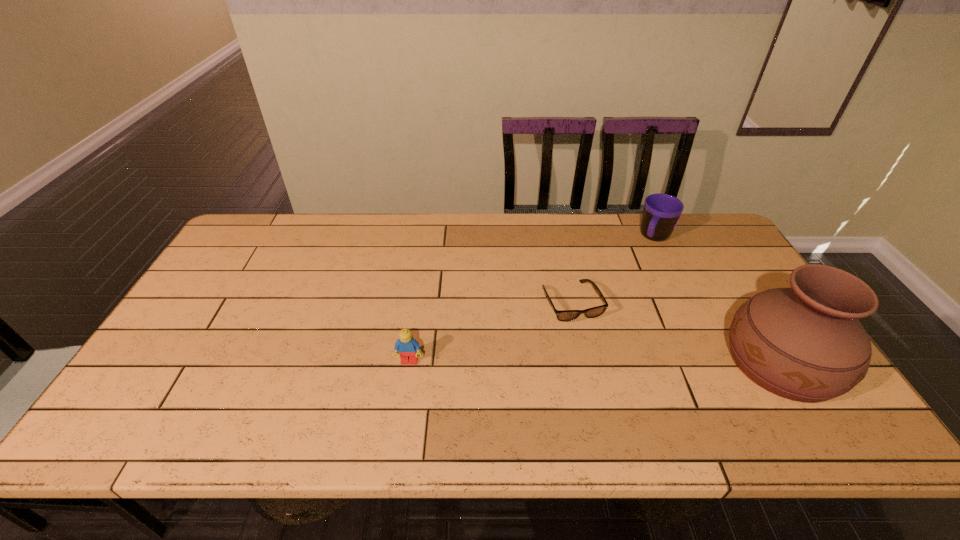
I want to click on free space between the mug and the leftmost object, so click(x=532, y=299).

Image resolution: width=960 pixels, height=540 pixels. In order to click on free space between the urn and the mug in this screenshot , I will do `click(718, 300)`.

Find the location of a particular element. Image resolution: width=960 pixels, height=540 pixels. free space between the urn and the spectacles is located at coordinates (676, 333).

This screenshot has height=540, width=960. I want to click on free area in between the leftmost object and the tallest object, so click(595, 362).

Locate an element on the screen. Image resolution: width=960 pixels, height=540 pixels. vacant space that's between the leftmost object and the tallest object is located at coordinates (595, 362).

Locate an element on the screen. The image size is (960, 540). free space between the tallest object and the spectacles is located at coordinates (676, 333).

The width and height of the screenshot is (960, 540). In order to click on unoccupied position between the leftmost object and the urn in this screenshot , I will do `click(595, 362)`.

Locate an element on the screen. free space between the shortest object and the mug is located at coordinates (613, 270).

You are a GUI agent. You are given a task and a screenshot of the screen. Output one action in this format:
    pyautogui.click(x=<x>, y=<y>)
    Task: Click on the vacant space that's between the Lego and the tallest object
    Image resolution: width=960 pixels, height=540 pixels.
    Given the screenshot: What is the action you would take?
    pyautogui.click(x=595, y=362)

Where is `free space between the shortest object and the leftmost object`? Image resolution: width=960 pixels, height=540 pixels. free space between the shortest object and the leftmost object is located at coordinates (491, 332).